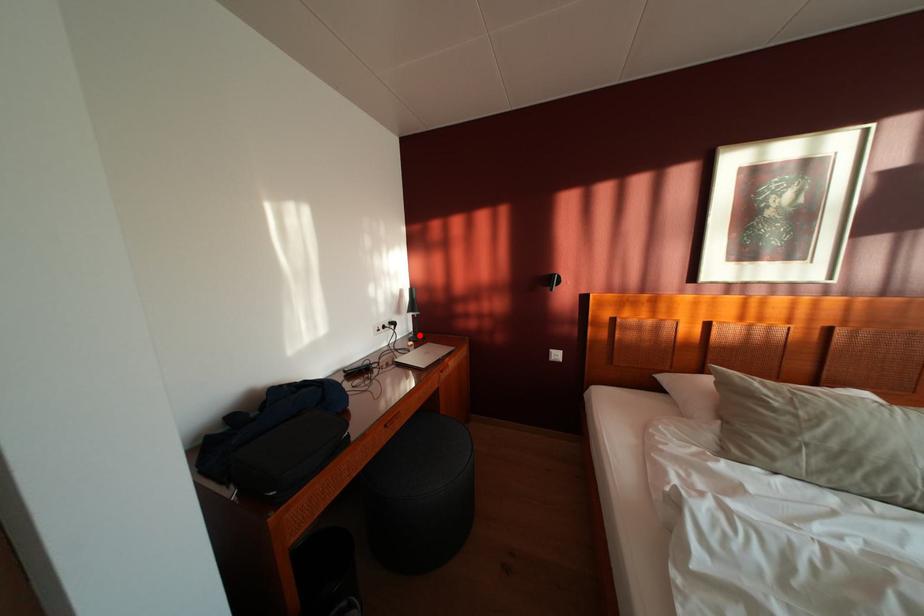
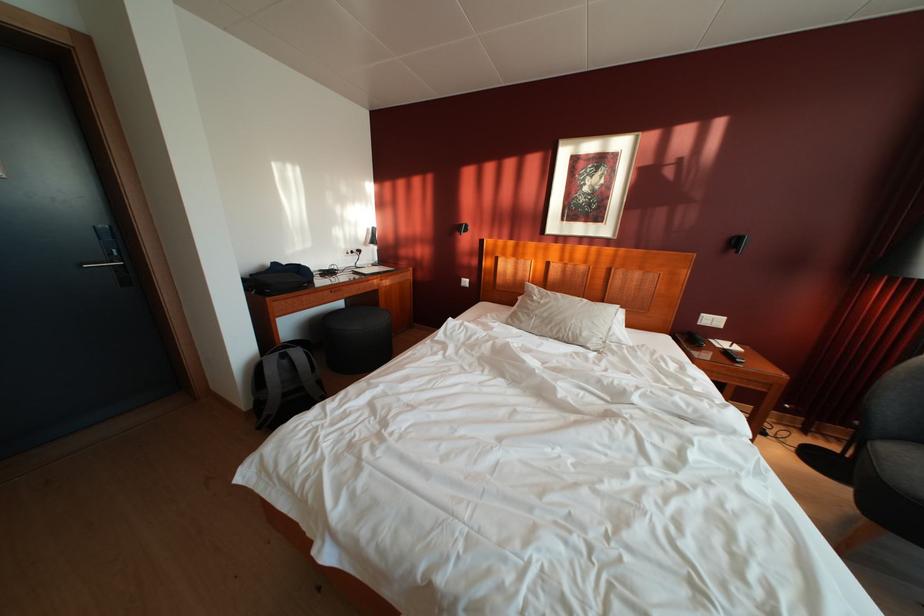
Where in the second image is the point corresponding to the highlighted location from the first image?

(384, 265)